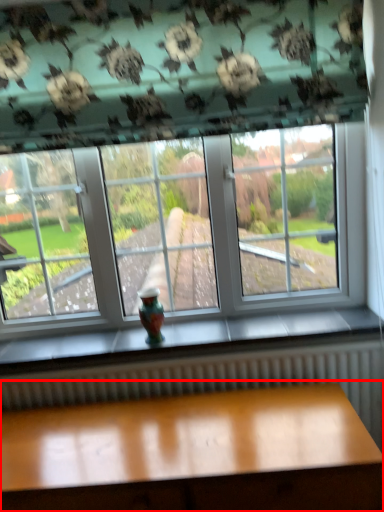
Question: From the image, what is the correct spatial relationship of table (annotated by the red box) in relation to glass vase?

Choices:
 (A) left
 (B) right

Answer: (B)